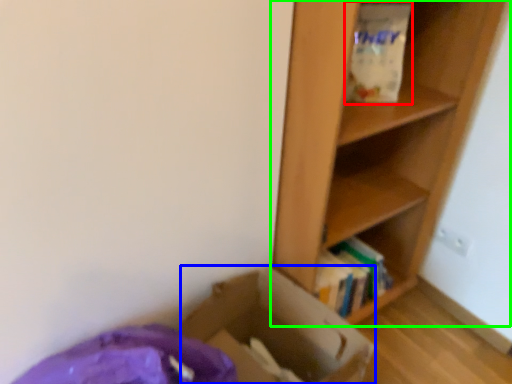
Question: Which object is the farthest from paper bag (highlighted by a red box)? Choose among these: cardboard box (highlighted by a blue box) or shelf (highlighted by a green box).

Choices:
 (A) cardboard box
 (B) shelf

Answer: (A)